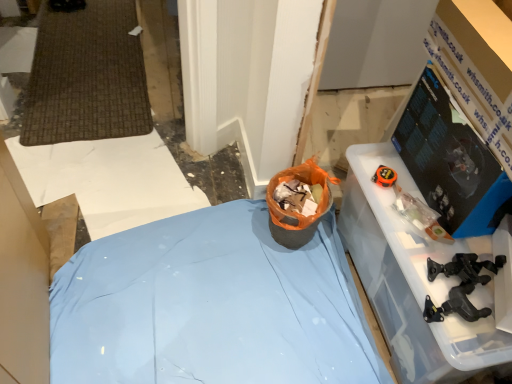
Question: Is transparent plastic container at right, which is counted as the 1th furniture, starting from the right, facing towards orange fabric bag at center?

Choices:
 (A) yes
 (B) no

Answer: (B)

Question: Can you confirm if transparent plastic container at right, arranged as the 2th furniture when viewed from the left, is taller than orange fabric bag at center?

Choices:
 (A) yes
 (B) no

Answer: (A)

Question: Is transparent plastic container at right, arranged as the 2th furniture when viewed from the left, positioned with its back to orange fabric bag at center?

Choices:
 (A) no
 (B) yes

Answer: (A)

Question: Does transparent plastic container at right, arranged as the 2th furniture when viewed from the left, appear on the right side of orange fabric bag at center?

Choices:
 (A) yes
 (B) no

Answer: (A)

Question: From the image's perspective, does transparent plastic container at right, arranged as the 2th furniture when viewed from the left, appear higher than orange fabric bag at center?

Choices:
 (A) no
 (B) yes

Answer: (A)

Question: Can you confirm if transparent plastic container at right, arranged as the 2th furniture when viewed from the left, is thinner than orange fabric bag at center?

Choices:
 (A) no
 (B) yes

Answer: (A)

Question: From a real-world perspective, is transparent plastic container at right, arranged as the 2th furniture when viewed from the left, positioned under blue fabric bed at center, the 2th furniture positioned from the right, based on gravity?

Choices:
 (A) yes
 (B) no

Answer: (B)

Question: Is blue fabric bed at center, the 2th furniture positioned from the right, surrounded by transparent plastic container at right, arranged as the 2th furniture when viewed from the left?

Choices:
 (A) yes
 (B) no

Answer: (B)

Question: Is transparent plastic container at right, arranged as the 2th furniture when viewed from the left, closer to the viewer compared to blue fabric bed at center, the 2th furniture positioned from the right?

Choices:
 (A) yes
 (B) no

Answer: (A)

Question: Can you confirm if transparent plastic container at right, which is counted as the 1th furniture, starting from the right, is smaller than blue fabric bed at center, arranged as the first furniture when viewed from the left?

Choices:
 (A) no
 (B) yes

Answer: (A)

Question: Can you confirm if transparent plastic container at right, which is counted as the 1th furniture, starting from the right, is shorter than blue fabric bed at center, arranged as the first furniture when viewed from the left?

Choices:
 (A) yes
 (B) no

Answer: (B)

Question: Is transparent plastic container at right, which is counted as the 1th furniture, starting from the right, bigger than blue fabric bed at center, the 2th furniture positioned from the right?

Choices:
 (A) yes
 (B) no

Answer: (A)

Question: Can you confirm if black plastic tool at lower right is positioned to the right of black glossy monitor at upper right?

Choices:
 (A) no
 (B) yes

Answer: (A)